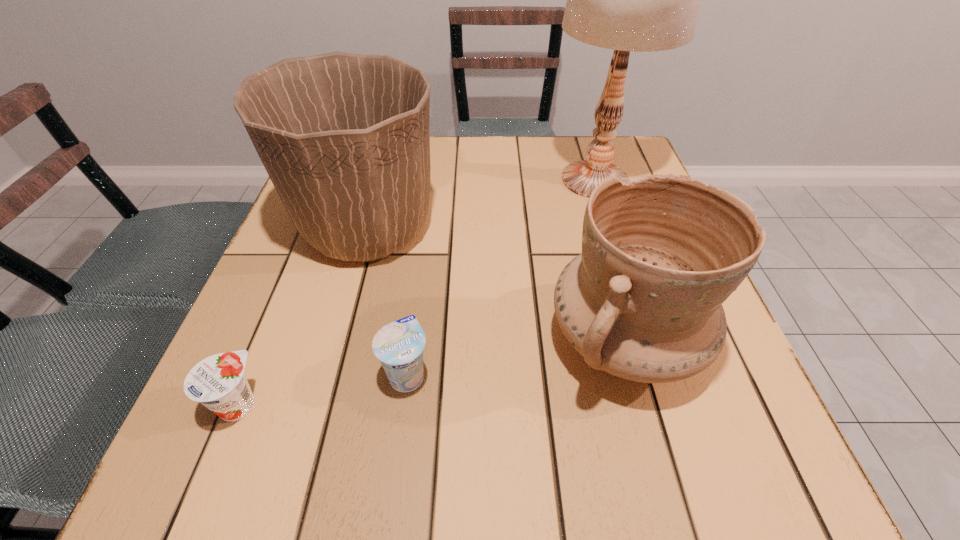
At what (x,y) coordinates should I click in order to perform the action: click on vacant space at the near edge of the desktop. Please return your answer as a coordinate pair (x, y). This screenshot has height=540, width=960. Looking at the image, I should click on (421, 469).

This screenshot has width=960, height=540. Identify the location of vacant space at the left edge of the desktop. (293, 235).

Identify the location of vacant space at the near left corner of the desktop. (272, 484).

This screenshot has width=960, height=540. I want to click on vacant space at the far right corner of the desktop, so click(579, 158).

In the image, there is a desktop. In order to click on vacant space at the near right corner in this screenshot , I will do `click(684, 446)`.

Find the location of `vacant area that lies between the flowerpot and the pottery`. vacant area that lies between the flowerpot and the pottery is located at coordinates (495, 284).

You are a GUI agent. You are given a task and a screenshot of the screen. Output one action in this format:
    pyautogui.click(x=<x>, y=<y>)
    Task: Click on the free spot between the right yogurt and the flowerpot
    The width and height of the screenshot is (960, 540).
    Given the screenshot: What is the action you would take?
    pyautogui.click(x=387, y=301)

You are a GUI agent. You are given a task and a screenshot of the screen. Output one action in this format:
    pyautogui.click(x=<x>, y=<y>)
    Task: Click on the vacant region between the tallest object and the flowerpot
    This screenshot has width=960, height=540.
    Given the screenshot: What is the action you would take?
    pyautogui.click(x=481, y=204)

The width and height of the screenshot is (960, 540). I want to click on free space between the right yogurt and the flowerpot, so click(x=387, y=301).

The width and height of the screenshot is (960, 540). I want to click on vacant area that lies between the tallest object and the right yogurt, so click(501, 277).